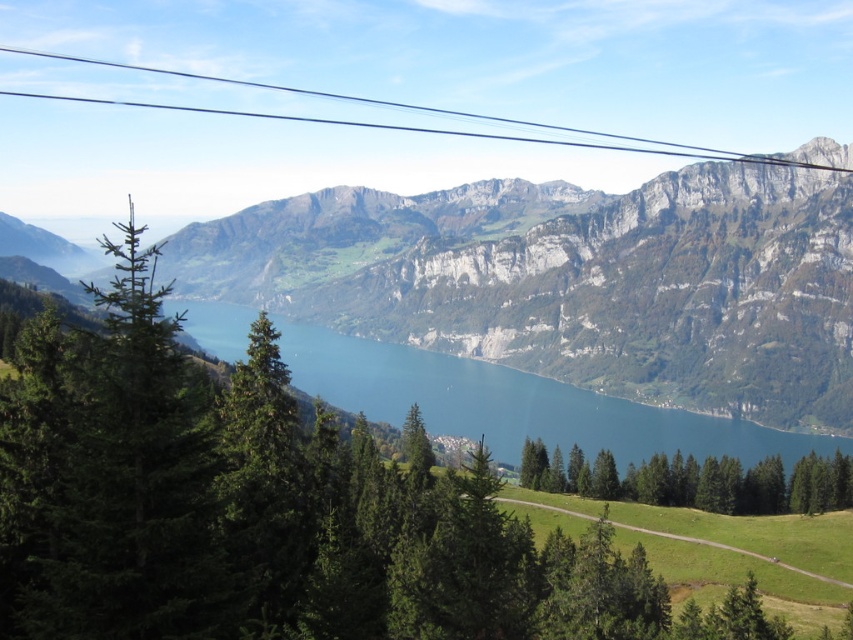
Question: Considering the relative positions of green grassy mountain at center and green matte tree at center in the image provided, where is green grassy mountain at center located with respect to green matte tree at center?

Choices:
 (A) left
 (B) right

Answer: (A)

Question: Which of the following is the farthest from the observer?

Choices:
 (A) (595, 483)
 (B) (291, 92)

Answer: (B)

Question: Which of the following is the farthest from the observer?

Choices:
 (A) (663, 147)
 (B) (751, 508)
 (C) (474, 285)

Answer: (A)

Question: Among these points, which one is nearest to the camera?

Choices:
 (A) (521, 465)
 (B) (323, 310)
 (C) (451, 112)

Answer: (A)

Question: Is the position of green matte tree at center more distant than that of black wire at upper center?

Choices:
 (A) yes
 (B) no

Answer: (B)

Question: Is green grassy mountain at center thinner than black wire at upper center?

Choices:
 (A) yes
 (B) no

Answer: (A)